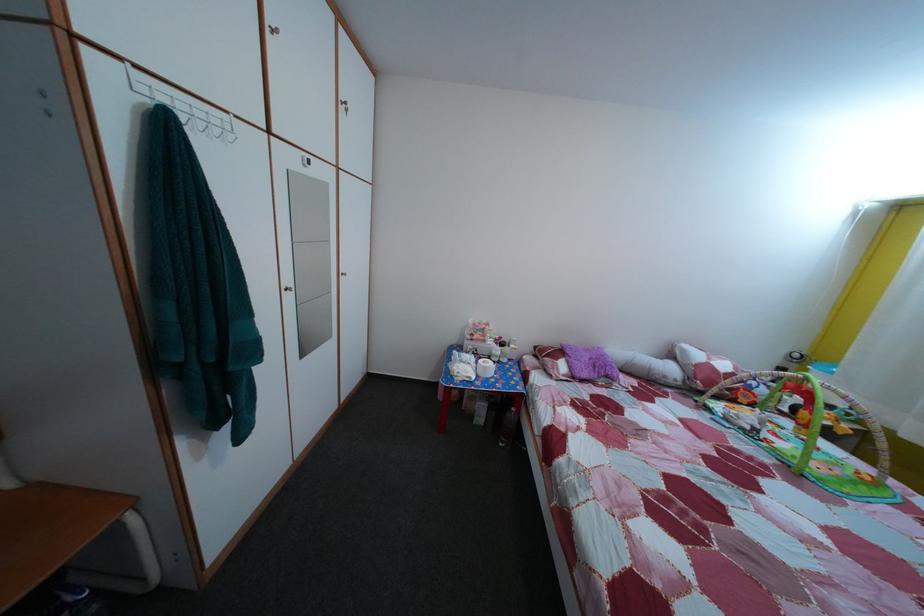
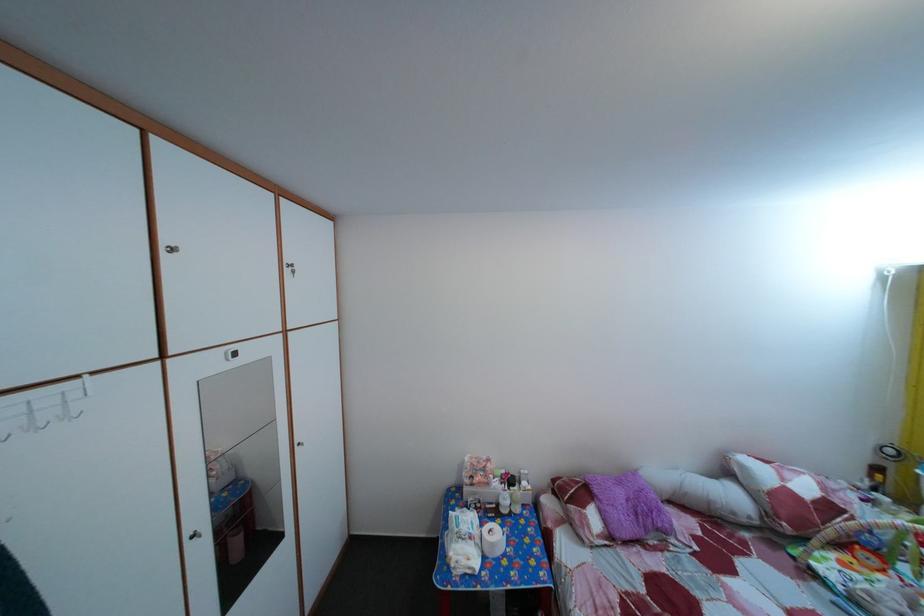
In a continuous first-person perspective shot, in which direction is the camera moving?

The cameraman moved toward right, forward.